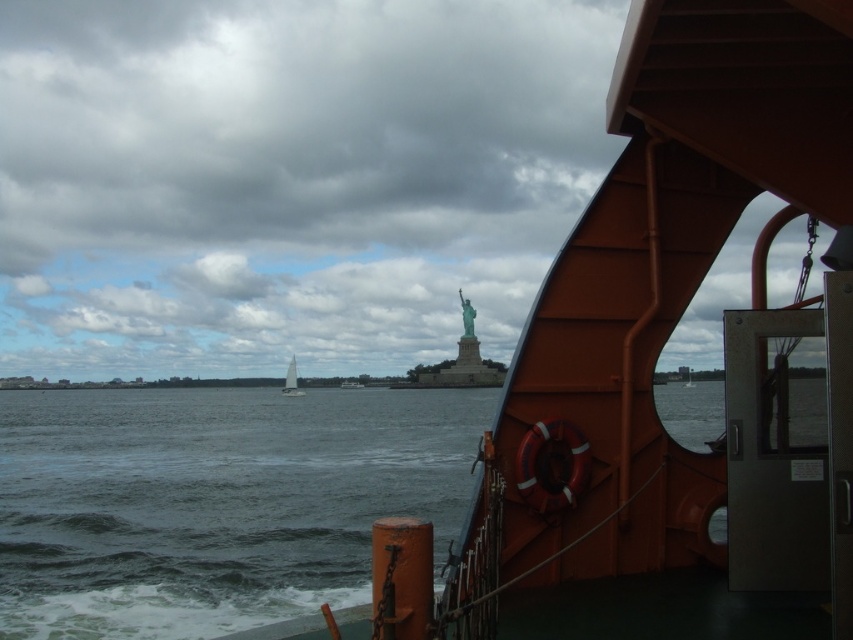
You are standing on the deck of the boat and want to throw a small floating toy into the water. The toy requires at least 20 feet of space to float safely. Based on the scene, can you determine if the dark gray water at center is far enough away to safely throw the toy?

The dark gray water at center is 21.52 feet from the camera, which is more than the required 20 feet of space. Therefore, it is safe to throw the toy into the dark gray water at center.

You are on a boat and see the green patina statue at center and the white sailboat at center. Which object is positioned to the right from your perspective?

The green patina statue at center is to the right of the white sailboat at center, so the green patina statue at center is positioned to the right.

You are standing on the boat deck and want to compare the sizes of the dark gray water at center and the green patina statue at center. Which one appears wider from your viewpoint?

The dark gray water at center appears wider than the green patina statue at center because its width is larger according to the description.